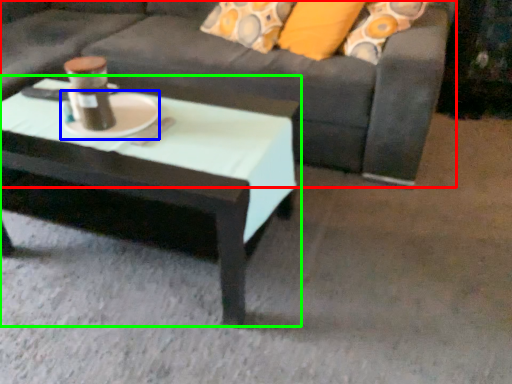
Question: Estimate the real-world distances between objects in this image. Which object is farther from studio couch (highlighted by a red box), platter (highlighted by a blue box) or coffee table (highlighted by a green box)?

Choices:
 (A) platter
 (B) coffee table

Answer: (A)